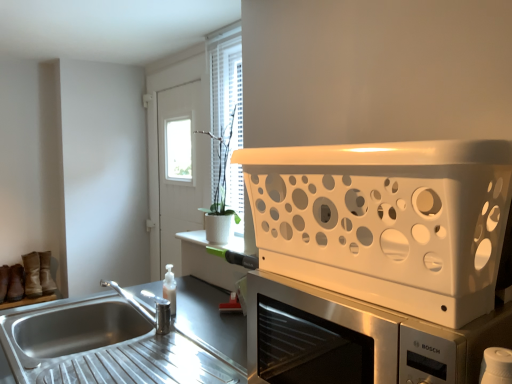
Where is `leather boot at left`? The width and height of the screenshot is (512, 384). leather boot at left is located at coordinates (46, 274).

What is the approximate width of brown leather shoe at lower left, marked as the 2th shoe in a right-to-left arrangement?

9.69 inches.

The image size is (512, 384). What are the coordinates of `white plastic basket at upper right` in the screenshot? It's located at (386, 221).

Describe the element at coordinates (386, 221) in the screenshot. The height and width of the screenshot is (384, 512). I see `white plastic basket at upper right` at that location.

What is the approximate width of white matte microwave oven at upper right?

The width of white matte microwave oven at upper right is 15.37 inches.

Image resolution: width=512 pixels, height=384 pixels. Describe the element at coordinates (32, 275) in the screenshot. I see `suede brown shoe at left, the 1th shoe in the right-to-left sequence` at that location.

What is the approximate width of suede brown shoe at left, the 1th shoe in the right-to-left sequence?

suede brown shoe at left, the 1th shoe in the right-to-left sequence, is 10.21 inches wide.

Describe the element at coordinates (170, 289) in the screenshot. Image resolution: width=512 pixels, height=384 pixels. I see `white glossy spray bottle at center` at that location.

I want to click on leather boot at left, so click(x=46, y=274).

Looking at their sizes, would you say stainless steel sink at lower left is wider or thinner than white glossy spray bottle at center?

stainless steel sink at lower left is wider than white glossy spray bottle at center.

Between stainless steel sink at lower left and white glossy spray bottle at center, which one has more height?

stainless steel sink at lower left.

Looking at this image, measure the distance from stainless steel sink at lower left to white glossy spray bottle at center.

The distance of stainless steel sink at lower left from white glossy spray bottle at center is 10.57 inches.

How different are the orientations of leather boot at left and brown suede boot at lower left, the third shoe positioned from the right, in degrees?

They differ by 9.11 degrees in their facing directions.

Is brown suede boot at lower left, which appears as the 1th shoe when viewed from the left, surrounded by leather boot at left?

No.

Can you confirm if leather boot at left is wider than brown suede boot at lower left, the third shoe positioned from the right?

Correct, the width of leather boot at left exceeds that of brown suede boot at lower left, the third shoe positioned from the right.

Considering the sizes of objects leather boot at left and brown suede boot at lower left, which appears as the 1th shoe when viewed from the left, in the image provided, who is smaller, leather boot at left or brown suede boot at lower left, which appears as the 1th shoe when viewed from the left,?

With smaller size is brown suede boot at lower left, which appears as the 1th shoe when viewed from the left.

Which is in front, white glossy spray bottle at center or stainless steel sink at lower left?

stainless steel sink at lower left.

Based on the photo, does white glossy spray bottle at center have a larger size compared to stainless steel sink at lower left?

No, white glossy spray bottle at center is not bigger than stainless steel sink at lower left.

Can you tell me how much white glossy spray bottle at center and stainless steel sink at lower left differ in facing direction?

white glossy spray bottle at center and stainless steel sink at lower left are facing 10 degrees away from each other.

Identify the location of countertop lying below the white glossy spray bottle at center (from the image's perspective). (126, 341).

In the scene shown: Would you say stainless steel sink at lower left contains leather boot at left?

Definitely not — leather boot at left is not inside stainless steel sink at lower left.

Consider the image. Considering the sizes of objects stainless steel sink at lower left and leather boot at left in the image provided, who is shorter, stainless steel sink at lower left or leather boot at left?

stainless steel sink at lower left is shorter.

The width and height of the screenshot is (512, 384). I want to click on countertop that is below the leather boot at left (from the image's perspective), so click(x=126, y=341).

Is stainless steel sink at lower left facing away from leather boot at left?

No, stainless steel sink at lower left is not facing away from leather boot at left.

How much distance is there between white glossy spray bottle at center and brown suede boot at lower left, the third shoe positioned from the right?

They are 3.93 feet apart.

Does white glossy spray bottle at center turn towards brown suede boot at lower left, the third shoe positioned from the right?

No, white glossy spray bottle at center is not turned towards brown suede boot at lower left, the third shoe positioned from the right.

Is white glossy spray bottle at center not close to brown suede boot at lower left, the third shoe positioned from the right?

white glossy spray bottle at center is positioned a significant distance from brown suede boot at lower left, the third shoe positioned from the right.

Considering the relative sizes of white glossy spray bottle at center and brown suede boot at lower left, the third shoe positioned from the right, in the image provided, is white glossy spray bottle at center taller than brown suede boot at lower left, the third shoe positioned from the right,?

Indeed, white glossy spray bottle at center has a greater height compared to brown suede boot at lower left, the third shoe positioned from the right.

Would you say suede brown shoe at left, marked as the 3th shoe in a left-to-right arrangement, is part of white glossy spray bottle at center's contents?

No, suede brown shoe at left, marked as the 3th shoe in a left-to-right arrangement, is not surrounded by white glossy spray bottle at center.

Can you confirm if white glossy spray bottle at center is bigger than suede brown shoe at left, marked as the 3th shoe in a left-to-right arrangement?

No.

Which object is thinner, white glossy spray bottle at center or suede brown shoe at left, the 1th shoe in the right-to-left sequence?

white glossy spray bottle at center.

Is the depth of white glossy spray bottle at center less than that of white plastic basket at upper right?

No, the depth of white glossy spray bottle at center is greater than that of white plastic basket at upper right.

Is white glossy spray bottle at center taller than white plastic basket at upper right?

In fact, white glossy spray bottle at center may be shorter than white plastic basket at upper right.

Which is behind, point (170, 277) or point (281, 199)?

Positioned behind is point (170, 277).

The width and height of the screenshot is (512, 384). In order to click on countertop below the white glossy spray bottle at center (from the image's perspective) in this screenshot , I will do `click(126, 341)`.

Locate an element on the screen. shoe that is the 3rd object located in front of the leather boot at left is located at coordinates (4, 282).

From the image, which object appears to be nearer to leather boot at left, brown leather shoe at lower left, marked as the 2th shoe in a right-to-left arrangement, or brown suede boot at lower left, the third shoe positioned from the right?

The object closer to leather boot at left is brown leather shoe at lower left, marked as the 2th shoe in a right-to-left arrangement.

Looking at the image, which one is located closer to white matte microwave oven at upper right, brown leather shoe at lower left, arranged as the second shoe when viewed from the left, or suede brown shoe at left, the 1th shoe in the right-to-left sequence?

suede brown shoe at left, the 1th shoe in the right-to-left sequence, is closer to white matte microwave oven at upper right.

Based on their spatial positions, is white glossy spray bottle at center or suede brown shoe at left, the 1th shoe in the right-to-left sequence, further from brown suede boot at lower left, the third shoe positioned from the right?

Among the two, white glossy spray bottle at center is located further to brown suede boot at lower left, the third shoe positioned from the right.

When comparing their distances from brown suede boot at lower left, which appears as the 1th shoe when viewed from the left, does suede brown shoe at left, marked as the 3th shoe in a left-to-right arrangement, or white glossy spray bottle at center seem closer?

suede brown shoe at left, marked as the 3th shoe in a left-to-right arrangement, is closer to brown suede boot at lower left, which appears as the 1th shoe when viewed from the left.

Looking at the image, which one is located closer to brown leather shoe at lower left, arranged as the second shoe when viewed from the left, suede brown shoe at left, marked as the 3th shoe in a left-to-right arrangement, or leather boot at left?

Among the two, suede brown shoe at left, marked as the 3th shoe in a left-to-right arrangement, is located nearer to brown leather shoe at lower left, arranged as the second shoe when viewed from the left.

From the image, which object appears to be nearer to suede brown shoe at left, the 1th shoe in the right-to-left sequence, brown suede boot at lower left, the third shoe positioned from the right, or white plastic basket at upper right?

brown suede boot at lower left, the third shoe positioned from the right, is closer to suede brown shoe at left, the 1th shoe in the right-to-left sequence.

From the image, which object appears to be farther from brown suede boot at lower left, which appears as the 1th shoe when viewed from the left, white glossy spray bottle at center or leather boot at left?

white glossy spray bottle at center lies further to brown suede boot at lower left, which appears as the 1th shoe when viewed from the left, than the other object.

In the scene shown: Looking at the image, which one is located closer to brown leather shoe at lower left, arranged as the second shoe when viewed from the left, white glossy spray bottle at center or leather boot at left?

leather boot at left is closer to brown leather shoe at lower left, arranged as the second shoe when viewed from the left.

This screenshot has height=384, width=512. What are the coordinates of `bottle positioned between white matte microwave oven at upper right and leather boot at left from near to far` in the screenshot? It's located at (170, 289).

Where is `bottle positioned between stainless steel sink at lower left and brown leather shoe at lower left, marked as the 2th shoe in a right-to-left arrangement, from near to far`? bottle positioned between stainless steel sink at lower left and brown leather shoe at lower left, marked as the 2th shoe in a right-to-left arrangement, from near to far is located at coordinates (170, 289).

Where is `microwave oven between white plastic basket at upper right and suede brown shoe at left, the 1th shoe in the right-to-left sequence, in the front-back direction`? microwave oven between white plastic basket at upper right and suede brown shoe at left, the 1th shoe in the right-to-left sequence, in the front-back direction is located at coordinates (357, 339).

This screenshot has height=384, width=512. Find the location of `bottle located between white matte microwave oven at upper right and brown leather shoe at lower left, marked as the 2th shoe in a right-to-left arrangement, in the depth direction`. bottle located between white matte microwave oven at upper right and brown leather shoe at lower left, marked as the 2th shoe in a right-to-left arrangement, in the depth direction is located at coordinates (170, 289).